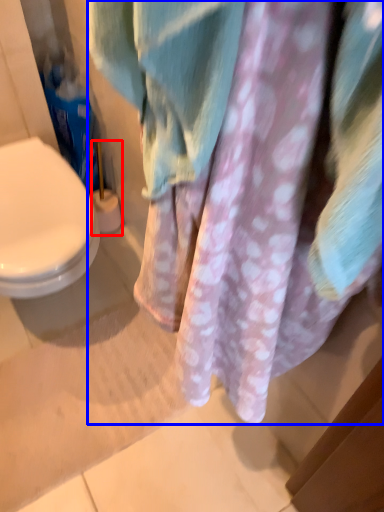
Question: Which object appears closest to the camera in this image, brush (highlighted by a red box) or laundry (highlighted by a blue box)?

Choices:
 (A) brush
 (B) laundry

Answer: (B)